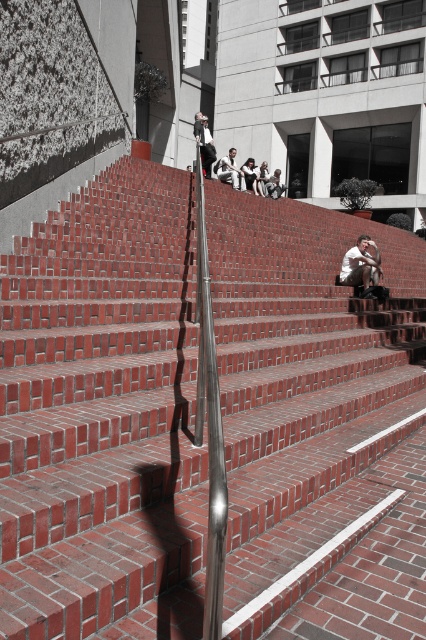
Question: Which object is closer to the camera taking this photo?

Choices:
 (A) white cotton shirt at center
 (B) white shirt at upper center
 (C) matte white shirt at center

Answer: (C)

Question: Does matte white shirt at center appear on the right side of white shirt at upper center?

Choices:
 (A) no
 (B) yes

Answer: (B)

Question: Which object appears farthest from the camera in this image?

Choices:
 (A) matte white shirt at center
 (B) white cotton shirt at center

Answer: (B)

Question: Does matte white shirt at center appear over white cotton shirt at center?

Choices:
 (A) no
 (B) yes

Answer: (A)

Question: Which object is the farthest from the white shirt at upper center?

Choices:
 (A) white cotton shirt at center
 (B) matte white shirt at center

Answer: (B)

Question: Does matte white shirt at center come behind white cotton shirt at center?

Choices:
 (A) no
 (B) yes

Answer: (A)